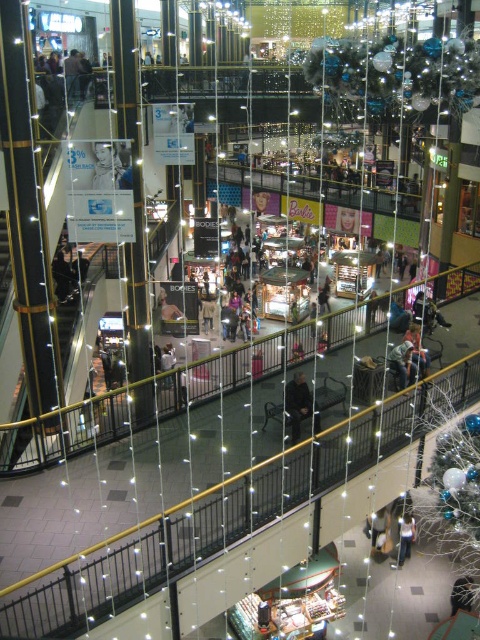
From the picture: Does dark gray jacket at center have a greater height compared to light blue denim jeans at lower center?

Indeed, dark gray jacket at center has a greater height compared to light blue denim jeans at lower center.

Does dark gray jacket at center have a lesser height compared to light blue denim jeans at lower center?

Incorrect, dark gray jacket at center's height does not fall short of light blue denim jeans at lower center's.

Which is behind, point (291, 392) or point (402, 557)?

The point (402, 557) is behind.

The image size is (480, 640). What are the coordinates of `dark gray jacket at center` in the screenshot? It's located at (298, 403).